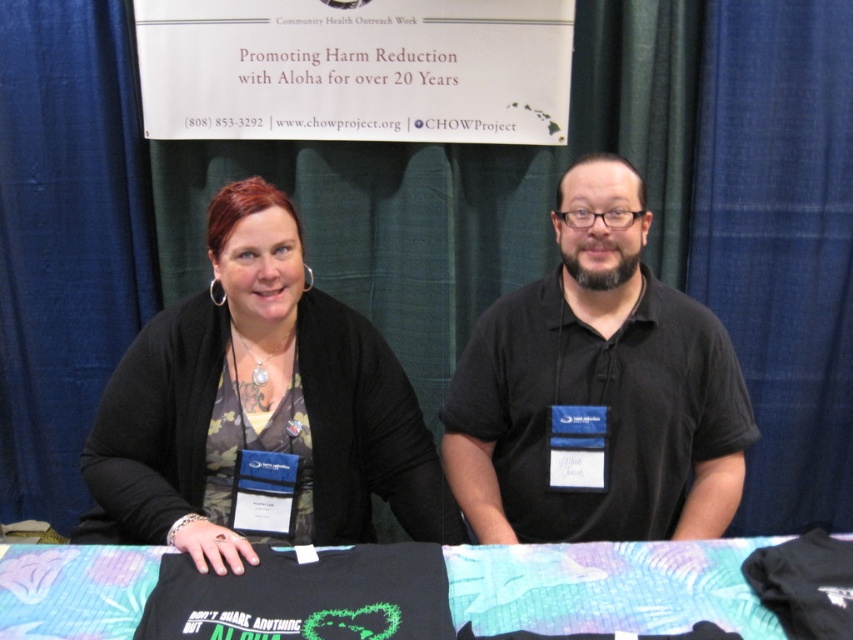
Which is below, camouflage fabric shirt at center or black fabric at center?

Positioned lower is black fabric at center.

Is point (144, 374) positioned behind point (659, 577)?

That is True.

Is point (405, 456) positioned behind point (689, 582)?

Yes, it is behind point (689, 582).

The image size is (853, 640). In order to click on camouflage fabric shirt at center in this screenshot , I will do `click(259, 404)`.

Is black matte shirt at center above black fabric at center?

Correct, black matte shirt at center is located above black fabric at center.

Who is more forward, (675, 384) or (679, 572)?

Point (679, 572)

You are a GUI agent. You are given a task and a screenshot of the screen. Output one action in this format:
    pyautogui.click(x=<x>, y=<y>)
    Task: Click on the black matte shirt at center
    The image size is (853, 640).
    Given the screenshot: What is the action you would take?
    pyautogui.click(x=598, y=387)

Between camouflage fabric shirt at center and black matte shirt at center, which one has more height?

Standing taller between the two is black matte shirt at center.

Is point (262, 422) positioned before point (547, 336)?

Yes, point (262, 422) is closer to viewer.

You are a GUI agent. You are given a task and a screenshot of the screen. Output one action in this format:
    pyautogui.click(x=<x>, y=<y>)
    Task: Click on the camouflage fabric shirt at center
    This screenshot has width=853, height=640.
    Given the screenshot: What is the action you would take?
    pyautogui.click(x=259, y=404)